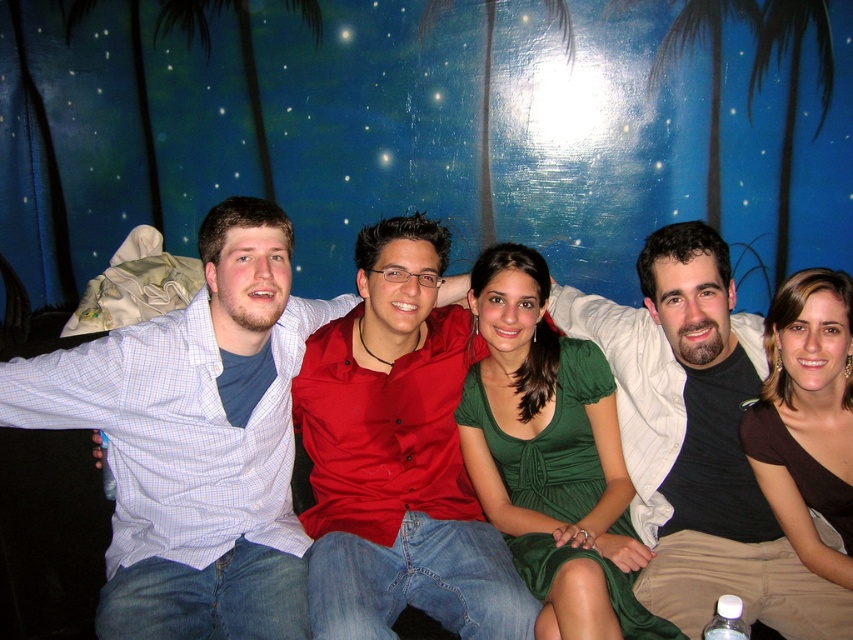
You are designing a poster for a tropical themed event and need to highlight both the blue painted wall at upper center and the light blue checkered shirt at center. Which object should you emphasize more in your design based on their sizes?

The blue painted wall at upper center should be emphasized more in the design because it is larger in size than the light blue checkered shirt at center.

You are organizing a photo shoot and need to arrange the models so that the light blue checkered shirt at center and the matte black shirt at center are visible in the final shot. Considering their heights, which model should stand in front to ensure both shirts are visible?

The matte black shirt at center should stand in front because the light blue checkered shirt at center is taller. This way, the taller model can be positioned behind to ensure both shirts are visible in the photo.

You are designing a poster and need to know which object in the image takes up more space. You see the blue painted wall at upper center and the matte black shirt at center. Which one is larger?

The blue painted wall at upper center is bigger than the matte black shirt at center according to the description.